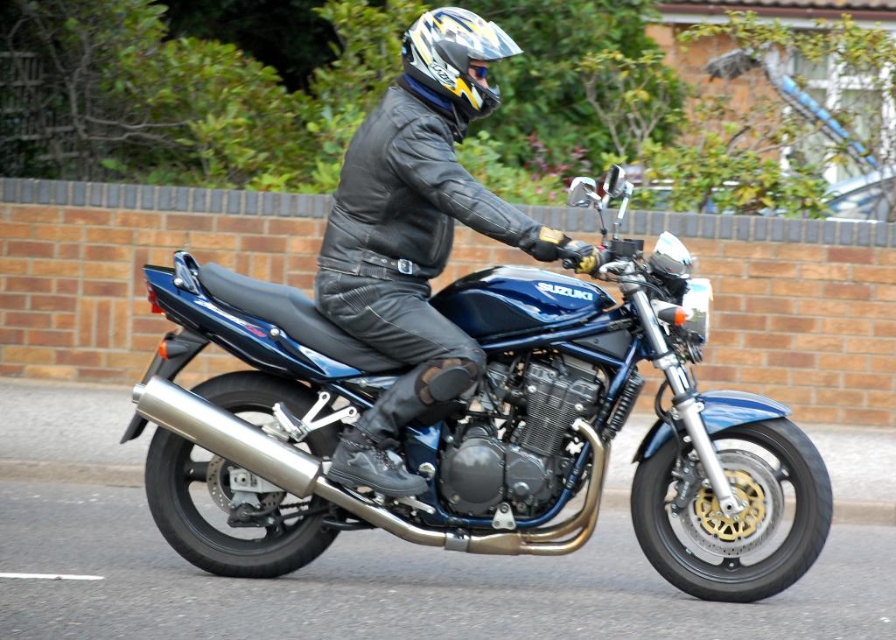
From the picture: You are a photographer trying to capture the blue metallic motorcycle at center and the matte black leather jacket at center in a single shot. Based on their positions, which object should you adjust your camera to focus on first to ensure both are in frame?

The blue metallic motorcycle at center is to the right of the matte black leather jacket at center, so you should focus on the motorcycle first to ensure both are in frame.

You are a photographer trying to capture a clear shot of the blue metallic motorcycle at center and the shiny multicolored helmet at center. Since you want to focus on the motorcycle, which object should you zoom in on and why?

You should zoom in on the blue metallic motorcycle at center because it is larger in size than the shiny multicolored helmet at center, making it easier to focus on the motorcycle.

You are a photographer trying to capture the motorcyclist. You notice the matte black leather jacket at center and the shiny multicolored helmet at center. Which object should you focus on if you want to photograph the larger one?

The matte black leather jacket at center is larger in size than the shiny multicolored helmet at center, so you should focus on the matte black leather jacket at center.